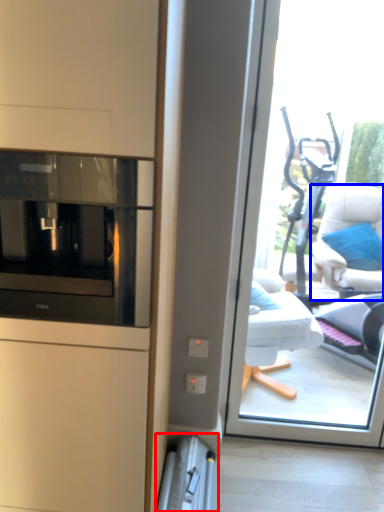
Question: Which point is further to the camera, appliance (highlighted by a red box) or furniture (highlighted by a blue box)?

Choices:
 (A) appliance
 (B) furniture

Answer: (B)